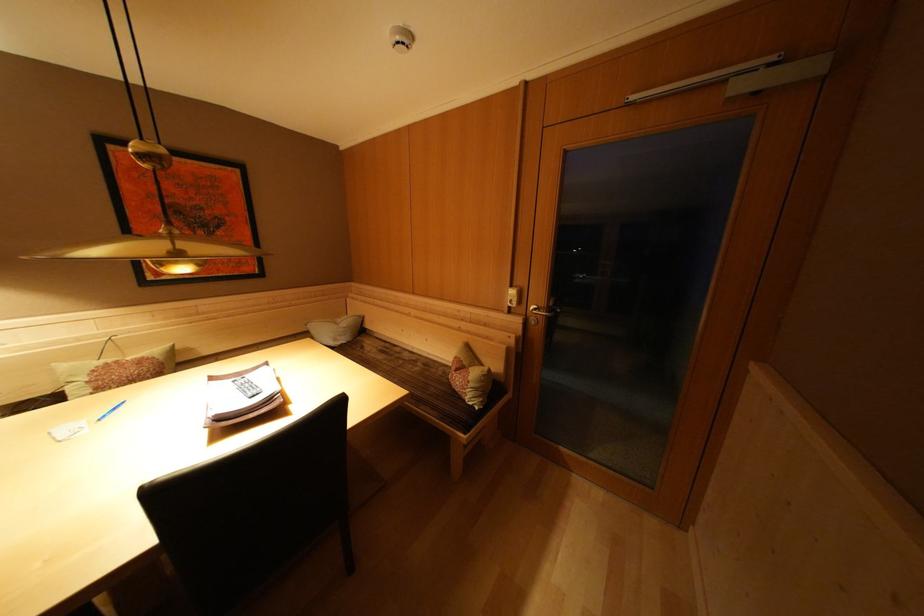
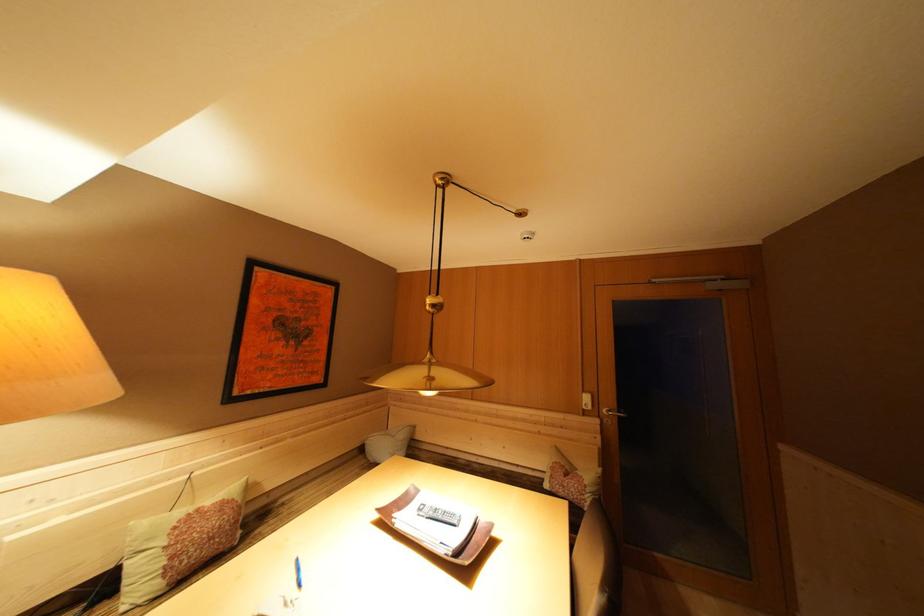
The point at (124, 367) is marked in the first image. Where is the corresponding point in the second image?

(204, 515)